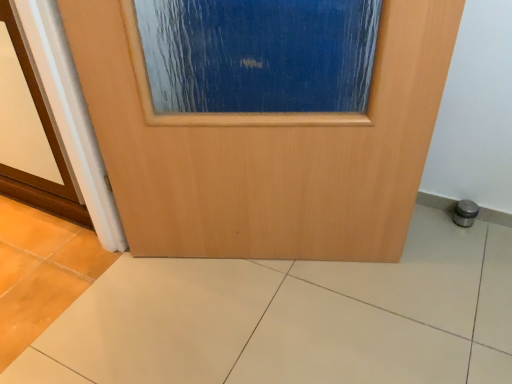
What do you see at coordinates (293, 318) in the screenshot? This screenshot has width=512, height=384. I see `beige ceramic tile at center` at bounding box center [293, 318].

The height and width of the screenshot is (384, 512). Find the location of `beige ceramic tile at center`. beige ceramic tile at center is located at coordinates (293, 318).

In the image, there is a wooden door at center. Find the location of `airplane window above it (from the image's perspective)`. airplane window above it (from the image's perspective) is located at coordinates (219, 113).

Could wooden door at center be considered to be inside blue textured glass at center?

No, wooden door at center is located outside of blue textured glass at center.

How far apart are blue textured glass at center and wooden door at center?

blue textured glass at center and wooden door at center are 7.04 inches apart from each other.

From the image's perspective, is blue textured glass at center beneath wooden door at center?

No, from the image's perspective, blue textured glass at center is not below wooden door at center.

Considering the relative sizes of beige ceramic tile at center and wooden door at center in the image provided, is beige ceramic tile at center smaller than wooden door at center?

Indeed, beige ceramic tile at center has a smaller size compared to wooden door at center.

Between beige ceramic tile at center and wooden door at center, which one has smaller width?

With smaller width is wooden door at center.

Does wooden door at center have a greater width compared to beige ceramic tile at center?

Incorrect, the width of wooden door at center does not surpass that of beige ceramic tile at center.

Consider the image. Can you confirm if wooden door at center is taller than beige ceramic tile at center?

Yes.

Based on their sizes in the image, would you say wooden door at center is bigger or smaller than beige ceramic tile at center?

Clearly, wooden door at center is larger in size than beige ceramic tile at center.

From a real-world perspective, relative to beige ceramic tile at center, is wooden door at center vertically above or below?

In terms of real-world spatial position, wooden door at center is above beige ceramic tile at center.

From the image's perspective, does wooden door at center appear higher than blue textured glass at center?

No, from the image's perspective, wooden door at center is not over blue textured glass at center.

Is point (251, 211) closer or farther from the camera than point (365, 122)?

Point (251, 211) is positioned farther from the camera compared to point (365, 122).

Is blue textured glass at center at the back of wooden door at center?

That's right, wooden door at center is facing away from blue textured glass at center.

From a real-world perspective, relative to blue textured glass at center, is wooden door at center vertically above or below?

From a real-world perspective, wooden door at center is physically below blue textured glass at center.

Between beige ceramic tile at center and blue textured glass at center, which one has more height?

blue textured glass at center is taller.

How many degrees apart are the facing directions of beige ceramic tile at center and blue textured glass at center?

They differ by 91.3 degrees in their facing directions.

Considering the positions of point (441, 280) and point (140, 39), is point (441, 280) closer or farther from the camera than point (140, 39)?

Point (441, 280) is farther from the camera than point (140, 39).

From the image's perspective, between beige ceramic tile at center and blue textured glass at center, who is located below?

beige ceramic tile at center is shown below in the image.

From the image's perspective, which is above, blue textured glass at center or beige ceramic tile at center?

From the image's view, blue textured glass at center is above.

How many degrees apart are the facing directions of blue textured glass at center and beige ceramic tile at center?

91.3 degrees separate the facing orientations of blue textured glass at center and beige ceramic tile at center.

Based on the photo, can you confirm if blue textured glass at center is taller than beige ceramic tile at center?

Correct, blue textured glass at center is much taller as beige ceramic tile at center.

Locate an element on the screen. door that is in front of the blue textured glass at center is located at coordinates (269, 152).

Identify the location of ceramic tile below the wooden door at center (from a real-world perspective). The height and width of the screenshot is (384, 512). (293, 318).

Which object lies further to the anchor point wooden door at center, blue textured glass at center or beige ceramic tile at center?

beige ceramic tile at center lies further to wooden door at center than the other object.

Considering their positions, is beige ceramic tile at center positioned closer to wooden door at center than blue textured glass at center?

blue textured glass at center is positioned closer to the anchor wooden door at center.

Considering their positions, is wooden door at center positioned closer to beige ceramic tile at center than blue textured glass at center?

wooden door at center is closer to beige ceramic tile at center.

Looking at this image, considering their positions, is wooden door at center positioned further to blue textured glass at center than beige ceramic tile at center?

The object further to blue textured glass at center is beige ceramic tile at center.

When comparing their distances from beige ceramic tile at center, does blue textured glass at center or wooden door at center seem further?

Among the two, blue textured glass at center is located further to beige ceramic tile at center.

From the image, which object appears to be farther from blue textured glass at center, beige ceramic tile at center or wooden door at center?

beige ceramic tile at center is positioned further to the anchor blue textured glass at center.

Identify the location of door that lies between blue textured glass at center and beige ceramic tile at center from top to bottom. Image resolution: width=512 pixels, height=384 pixels. 269,152.